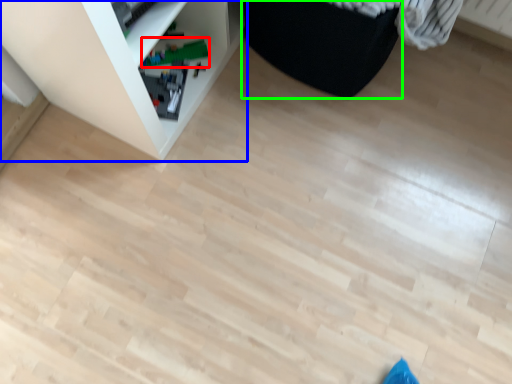
Question: Which object is positioned farthest from toy (highlighted by a red box)? Select from shelf (highlighted by a blue box) and furniture (highlighted by a green box).

Choices:
 (A) shelf
 (B) furniture

Answer: (B)